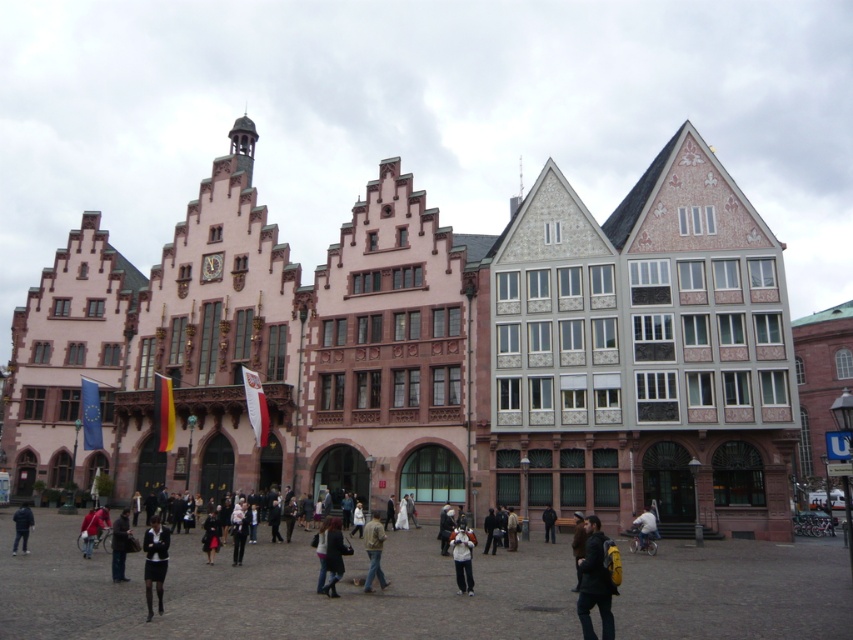
Question: Can you confirm if dark brown leather jacket at lower right is smaller than dark blue jacket at center?

Choices:
 (A) no
 (B) yes

Answer: (A)

Question: Which of the following is the farthest from the observer?

Choices:
 (A) (590, 593)
 (B) (634, 528)
 (C) (549, 506)
 (D) (381, 582)

Answer: (C)

Question: Which of these objects is positioned closest to the dark blue jacket at lower left?

Choices:
 (A) red fabric jacket at lower left
 (B) white cotton jacket at center
 (C) denim jacket at center

Answer: (A)

Question: Is red fabric jacket at lower left wider than light blue denim jacket at lower center?

Choices:
 (A) yes
 (B) no

Answer: (A)

Question: Which point is closer to the camera taking this photo?

Choices:
 (A) (611, 634)
 (B) (654, 531)

Answer: (A)

Question: From the image, what is the correct spatial relationship of denim jacket at center in relation to light blue denim jacket at lower center?

Choices:
 (A) right
 (B) left

Answer: (B)